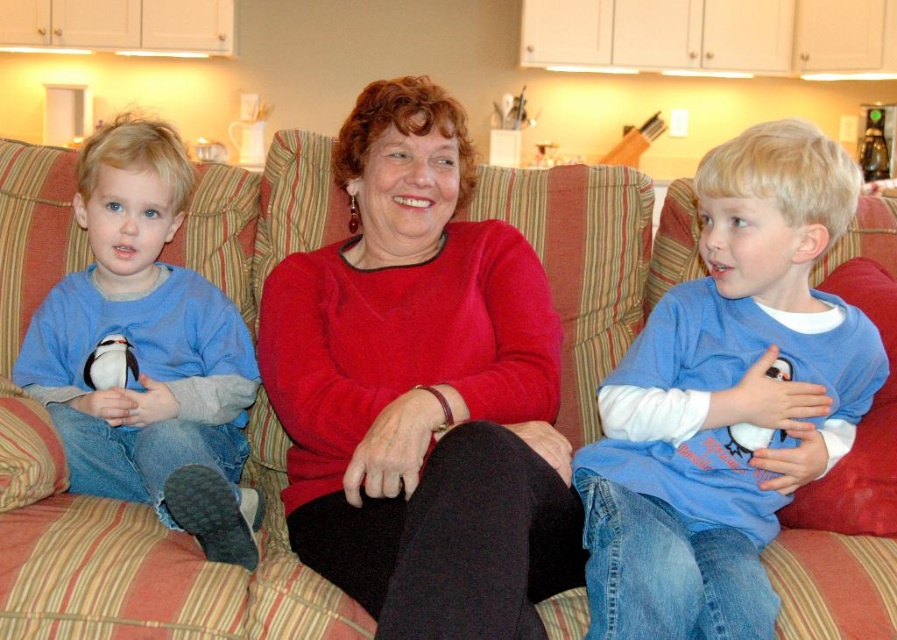
Does matte red sweater at center have a lesser width compared to matte blue shirt at left?

No, matte red sweater at center is not thinner than matte blue shirt at left.

Who is lower down, matte red sweater at center or matte blue shirt at left?

matte blue shirt at left

This screenshot has width=897, height=640. Describe the element at coordinates (421, 388) in the screenshot. I see `matte red sweater at center` at that location.

Where is `matte red sweater at center`? The height and width of the screenshot is (640, 897). matte red sweater at center is located at coordinates (421, 388).

Who is more forward, (854, 362) or (242, 508)?

Point (854, 362) is in front.

Is blue cotton shirt at right positioned behind matte blue shirt at left?

No, blue cotton shirt at right is closer to the viewer.

You are a GUI agent. You are given a task and a screenshot of the screen. Output one action in this format:
    pyautogui.click(x=<x>, y=<y>)
    Task: Click on the blue cotton shirt at right
    The image size is (897, 640).
    Given the screenshot: What is the action you would take?
    pyautogui.click(x=727, y=400)

Does point (543, 589) come behind point (758, 588)?

Yes, it is behind point (758, 588).

How far apart are matte red sweater at center and blue cotton shirt at right?

They are 11.25 inches apart.

Does point (366, 458) lie in front of point (776, 230)?

Yes, point (366, 458) is in front of point (776, 230).

Image resolution: width=897 pixels, height=640 pixels. I want to click on matte red sweater at center, so click(421, 388).